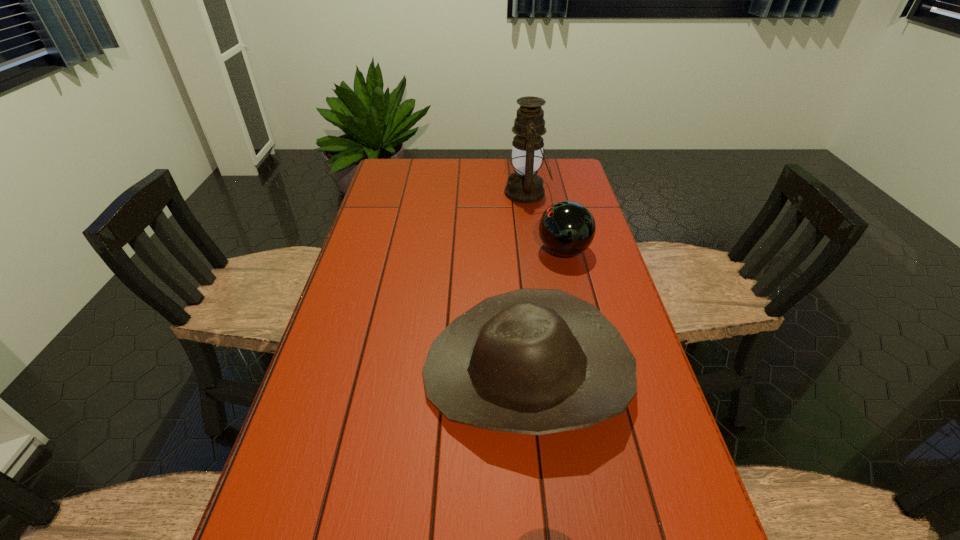
Where is `the closest object relative to the tallest object`? This screenshot has width=960, height=540. the closest object relative to the tallest object is located at coordinates (567, 228).

The image size is (960, 540). What are the coordinates of `free point that satisfies the following two spatial constraints: 1. on the back side of the oil lamp; 2. on the left side of the cowboy hat` in the screenshot? It's located at (510, 193).

I want to click on vacant position in the image that satisfies the following two spatial constraints: 1. on the back side of the cowboy hat; 2. on the left side of the oil lamp, so click(510, 193).